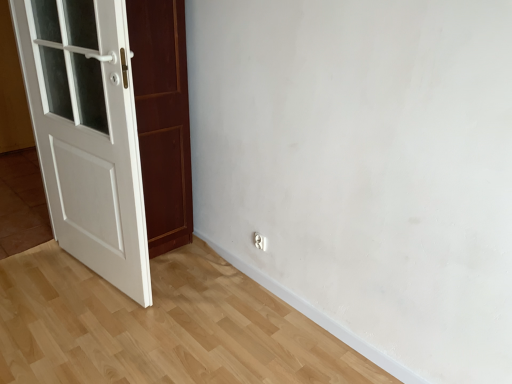
Image resolution: width=512 pixels, height=384 pixels. I want to click on free space in front of white wooden door at left, so click(x=109, y=296).